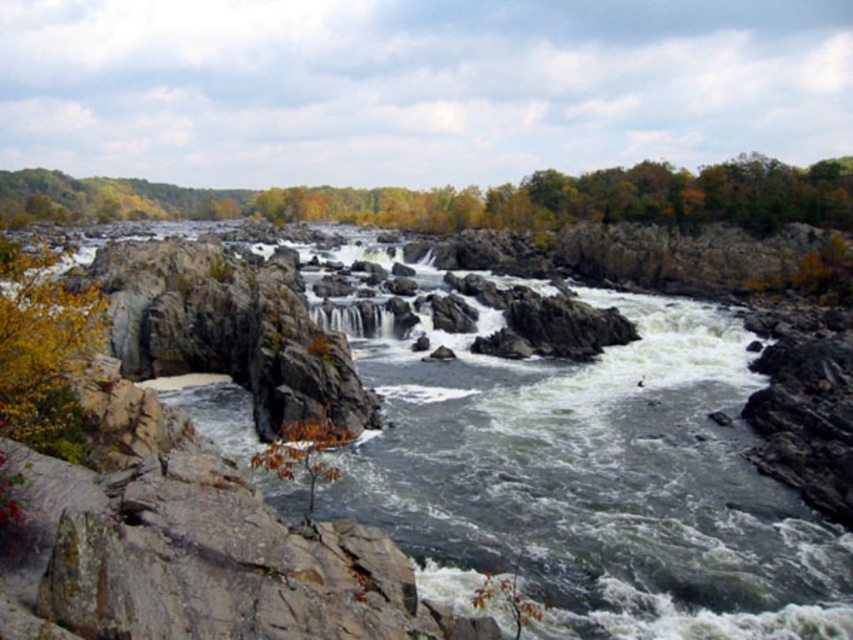
In the scene shown: You are a hiker who wants to cross the river at the location shown in the image. You notice an orange leafy tree at lower center and white textured water at center. Which object is closer to the riverbank where you are standing?

The orange leafy tree at lower center is located below the white textured water at center, so it is closer to the riverbank where you are standing.